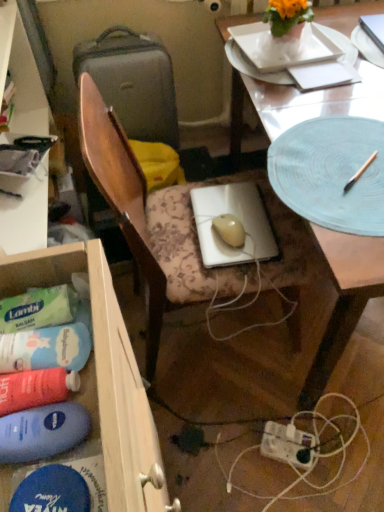
Locate an element on the screen. vacant region to the left of blue matte paper plate at upper right is located at coordinates 349,75.